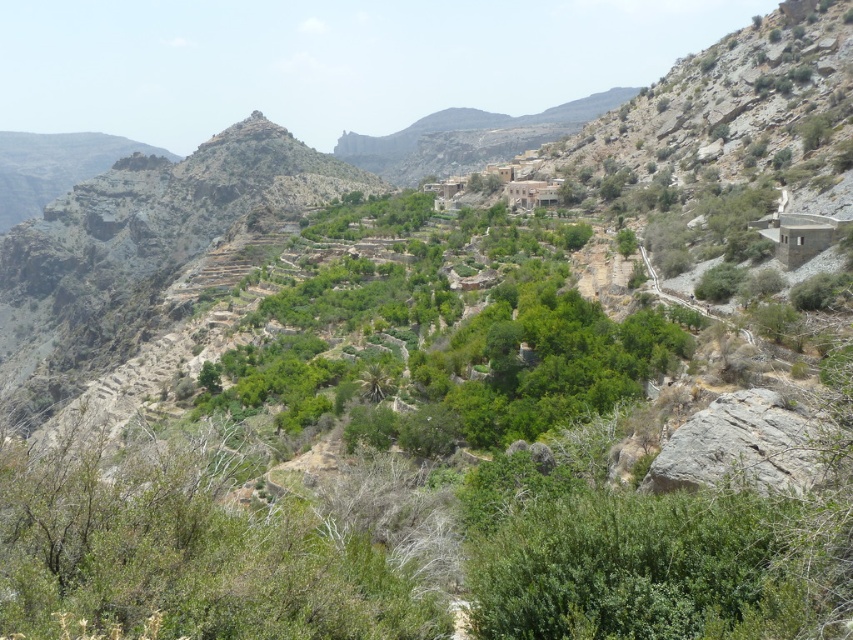
You are a hiker planning to set up a tent in the green leafy shrubs at center and the brown stone village at upper center. Which location offers more space for your tent based on their widths?

The green leafy shrubs at center might be wider than the brown stone village at upper center, so the green leafy shrubs at center likely provides more space for your tent.

You are a hiker navigating through the mountainous terrain. You come across a point marked at coordinates (451,353). What type of vegetation would you expect to find there?

At point (451,353) lies green leafy shrubs at center, so you would expect to find green leafy shrubs there.